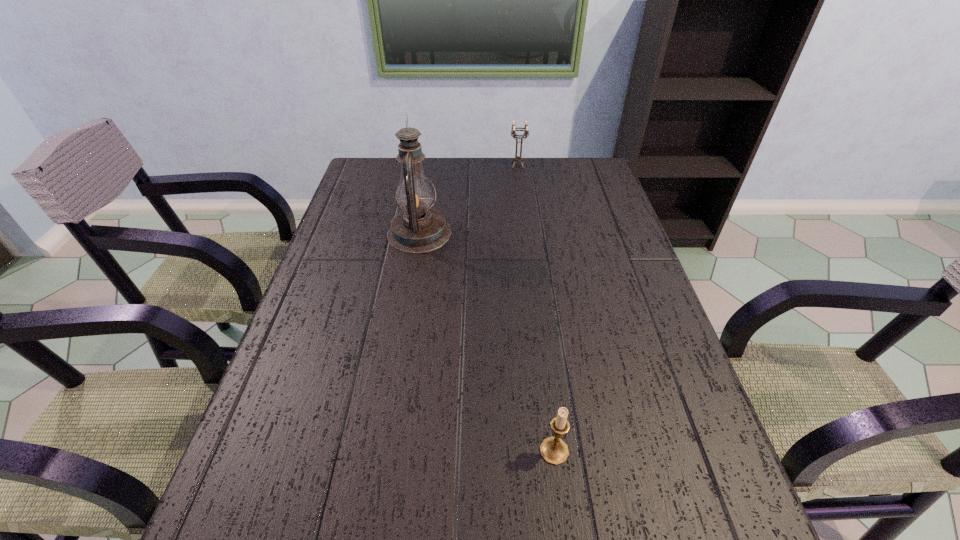
Locate an element on the screen. candle holder that stands as the closest to the leftmost object is located at coordinates (526, 132).